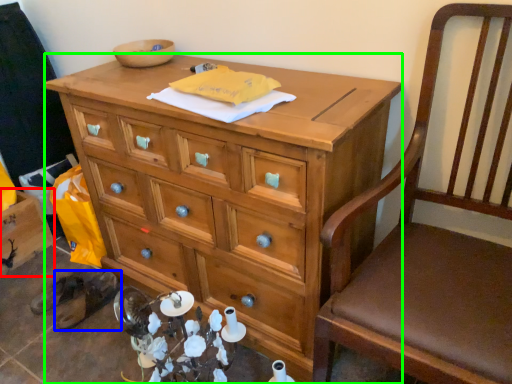
Question: Which object is the closest to the cabinetry (highlighted by a red box)? Choose among these: footwear (highlighted by a blue box) or desk (highlighted by a green box).

Choices:
 (A) footwear
 (B) desk

Answer: (A)